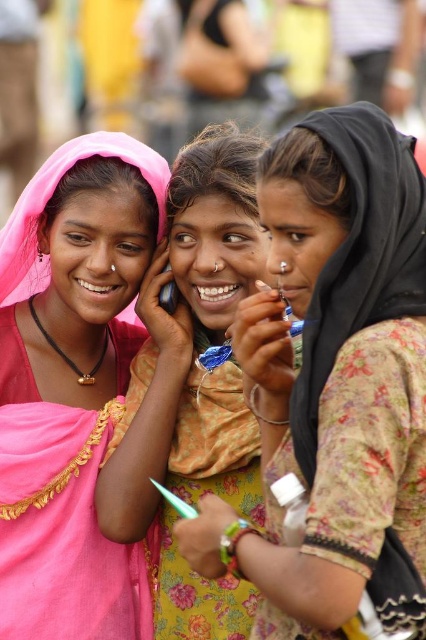
Who is shorter, floral fabric dress at center or pink fabric saree at left?

Standing shorter between the two is floral fabric dress at center.

Is floral fabric dress at center bigger than pink fabric saree at left?

No.

Locate an element on the screen. floral fabric dress at center is located at coordinates (333, 380).

Between point (46, 236) and point (216, 401), which one is positioned behind?

Positioned behind is point (46, 236).

Is pink fabric saree at left above pink fabric headscarf at center?

Actually, pink fabric saree at left is below pink fabric headscarf at center.

At what (x,y) coordinates should I click in order to perform the action: click on pink fabric saree at left. Please return your answer as a coordinate pair (x, y). This screenshot has height=640, width=426. Looking at the image, I should click on (71, 387).

Who is lower down, pink fabric headscarf at center or matte plastic phone at center?

pink fabric headscarf at center

Is point (115, 440) more distant than point (173, 310)?

No, (115, 440) is in front of (173, 310).

At what (x,y) coordinates should I click in order to perform the action: click on pink fabric headscarf at center. Please return your answer as a coordinate pair (x, y). This screenshot has height=640, width=426. Looking at the image, I should click on (193, 346).